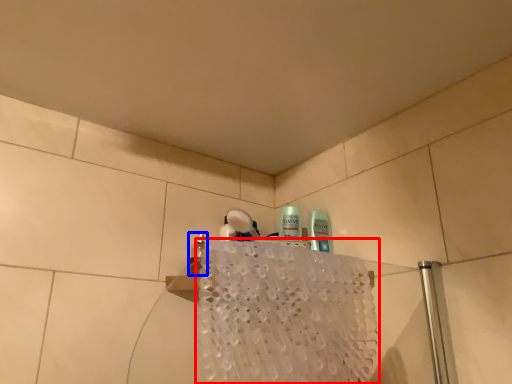
Question: Which of the following is the farthest to the observer, bath towel (highlighted by a red box) or mouthwash (highlighted by a blue box)?

Choices:
 (A) bath towel
 (B) mouthwash

Answer: (B)